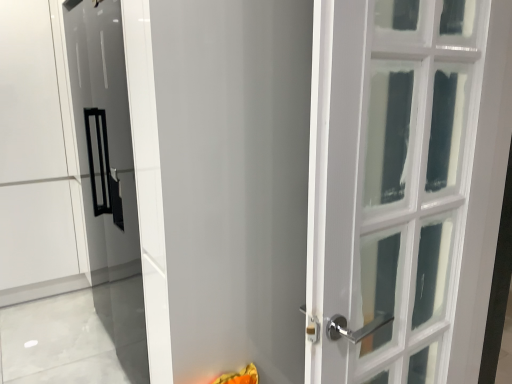
What is the approximate height of white glossy screen door at center?

It is 6.69 feet.

What do you see at coordinates (234, 181) in the screenshot?
I see `white glossy screen door at center` at bounding box center [234, 181].

At what (x,y) coordinates should I click in order to perform the action: click on white glossy screen door at center. Please return your answer as a coordinate pair (x, y). Image resolution: width=512 pixels, height=384 pixels. Looking at the image, I should click on (234, 181).

Where is `white glossy screen door at center`? white glossy screen door at center is located at coordinates (234, 181).